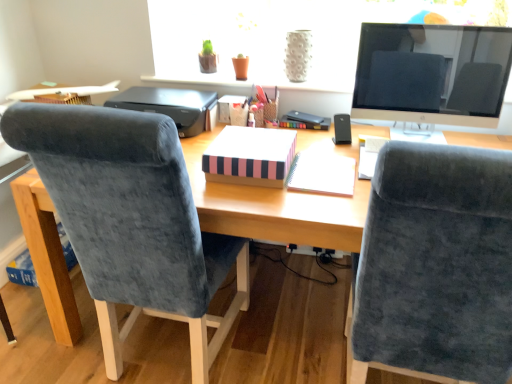
Question: From the image's perspective, is matte black monitor at upper right positioned above or below velvet blue chair at right, acting as the second chair starting from the left?

Choices:
 (A) below
 (B) above

Answer: (B)

Question: In terms of height, does matte black monitor at upper right look taller or shorter compared to velvet blue chair at right, the 1th chair in the right-to-left sequence?

Choices:
 (A) short
 (B) tall

Answer: (A)

Question: Which of these objects is positioned closest to the velvet blue chair at left, the first chair from the left?

Choices:
 (A) matte black monitor at upper right
 (B) velvet blue chair at right, the 1th chair in the right-to-left sequence
 (C) black plastic speaker at right
 (D) black plastic printer at upper center
 (E) wooden desk at center

Answer: (E)

Question: Which object is the farthest from the velvet blue chair at right, acting as the second chair starting from the left?

Choices:
 (A) black plastic printer at upper center
 (B) black plastic speaker at right
 (C) pink striped notebook at center, the first notebook from the left
 (D) white spiral notebook at center, which is the second notebook from left to right
 (E) wooden desk at center

Answer: (A)